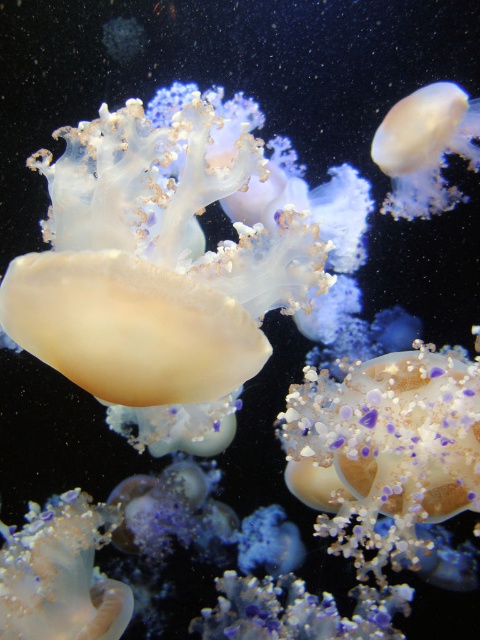
Question: Which object appears farthest from the camera in this image?

Choices:
 (A) translucent gelatinous at center
 (B) translucent gelatinous at lower left

Answer: (B)

Question: Which object appears farthest from the camera in this image?

Choices:
 (A) translucent gelatinous at center
 (B) translucent gelatinous at lower left

Answer: (B)

Question: Which of these objects is positioned closest to the translucent gelatinous at lower left?

Choices:
 (A) translucent gelatinous at center
 (B) translucent gelatinous at upper right

Answer: (A)

Question: Is translucent gelatinous at center closer to the viewer compared to translucent gelatinous at lower left?

Choices:
 (A) no
 (B) yes

Answer: (B)

Question: Can you confirm if translucent gelatinous at lower left is positioned to the right of translucent gelatinous at upper right?

Choices:
 (A) yes
 (B) no

Answer: (B)

Question: Is translucent gelatinous at center positioned behind translucent gelatinous at upper right?

Choices:
 (A) no
 (B) yes

Answer: (A)